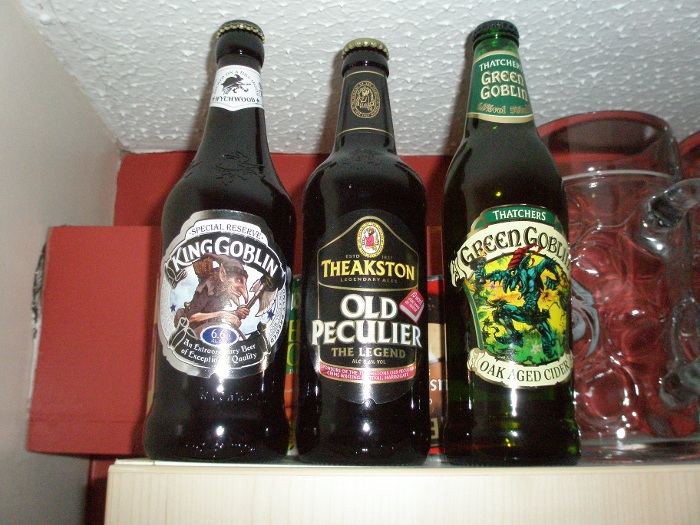
The height and width of the screenshot is (525, 700). I want to click on wall, so click(10, 292), click(147, 196), click(694, 142).